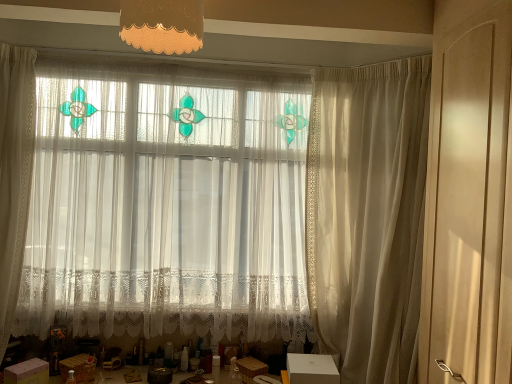
You are a GUI agent. You are given a task and a screenshot of the screen. Output one action in this format:
    pyautogui.click(x=<x>, y=<y>)
    Task: Click on the vacant space situated above white lace curtain at center, which is the 2th curtain from right to left (from a real-world perspective)
    Image resolution: width=512 pixels, height=384 pixels.
    Given the screenshot: What is the action you would take?
    pyautogui.click(x=166, y=54)